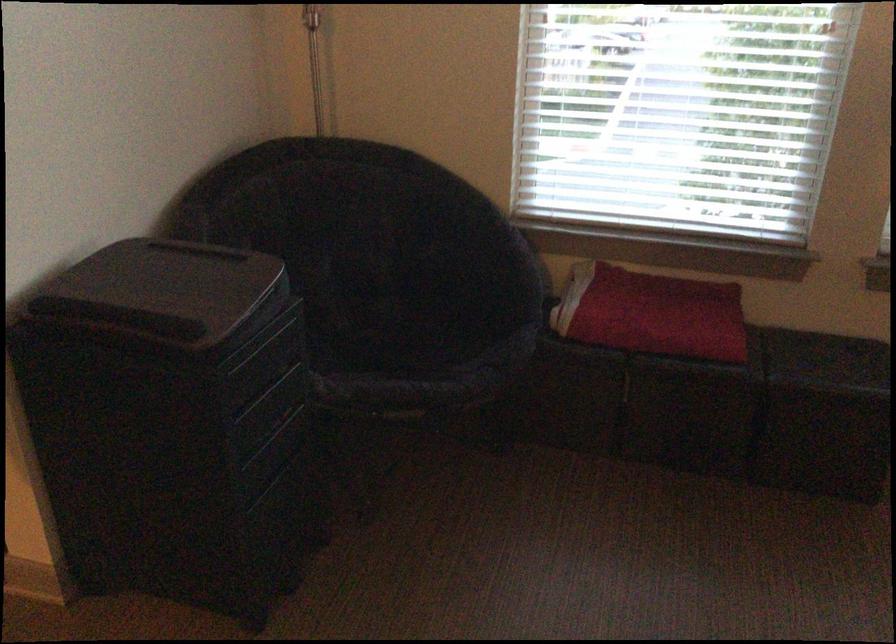
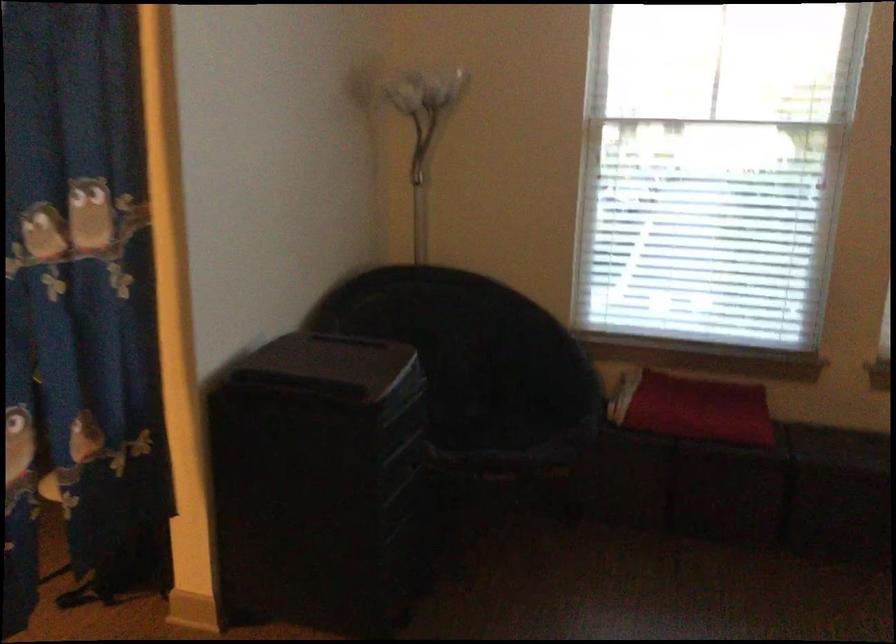
Question: Based on the continuous images, in which direction is the camera rotating? Reply with the corresponding letter.

Choices:
 (A) Left
 (B) Right
 (C) Up
 (D) Down

Answer: (C)